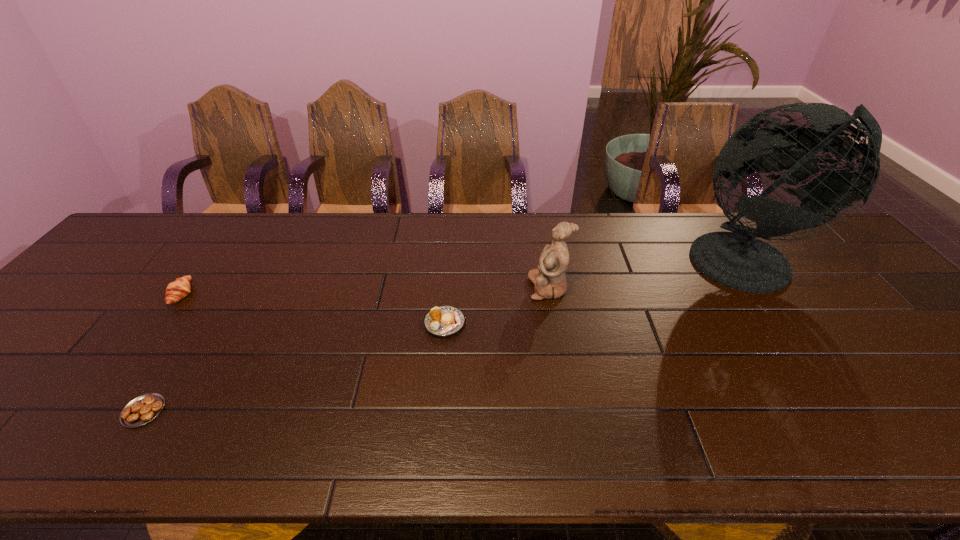
Locate an element on the screen. Image resolution: width=960 pixels, height=540 pixels. empty space that is in between the third shortest object and the rightmost object is located at coordinates pos(467,278).

I want to click on vacant space that's between the fourth shortest object and the leftmost pastry, so click(366, 291).

You are a GUI agent. You are given a task and a screenshot of the screen. Output one action in this format:
    pyautogui.click(x=<x>, y=<y>)
    Task: Click on the free space that is in between the second shortest object and the leftmost object
    This screenshot has height=540, width=960.
    Given the screenshot: What is the action you would take?
    pyautogui.click(x=313, y=309)

In order to click on free space between the fourth shortest object and the third object from left to right in this screenshot , I will do `click(497, 306)`.

At what (x,y) coordinates should I click in order to perform the action: click on free space between the nearest pastry and the rightmost object. Please return your answer as a coordinate pair (x, y). Looking at the image, I should click on (447, 336).

Choose which object is the nearest neighbor to the tallest pastry. Please provide its 2D coordinates. Your answer should be formatted as a tuple, i.e. [(x, y)], where the tuple contains the x and y coordinates of a point satisfying the conditions above.

[(143, 409)]

Locate which object ranks fourth in proximity to the figurine. Please provide its 2D coordinates. Your answer should be formatted as a tuple, i.e. [(x, y)], where the tuple contains the x and y coordinates of a point satisfying the conditions above.

[(180, 288)]

You are a GUI agent. You are given a task and a screenshot of the screen. Output one action in this format:
    pyautogui.click(x=<x>, y=<y>)
    Task: Click on the pastry that is the closest to the second object from left to right
    The width and height of the screenshot is (960, 540).
    Given the screenshot: What is the action you would take?
    pyautogui.click(x=180, y=288)

Locate which pastry is the closest to the rightmost pastry. Please provide its 2D coordinates. Your answer should be formatted as a tuple, i.e. [(x, y)], where the tuple contains the x and y coordinates of a point satisfying the conditions above.

[(143, 409)]

The height and width of the screenshot is (540, 960). Identify the location of free location that satisfies the following two spatial constraints: 1. on the back side of the nearest object; 2. on the front-facing side of the leftmost pastry. (219, 295).